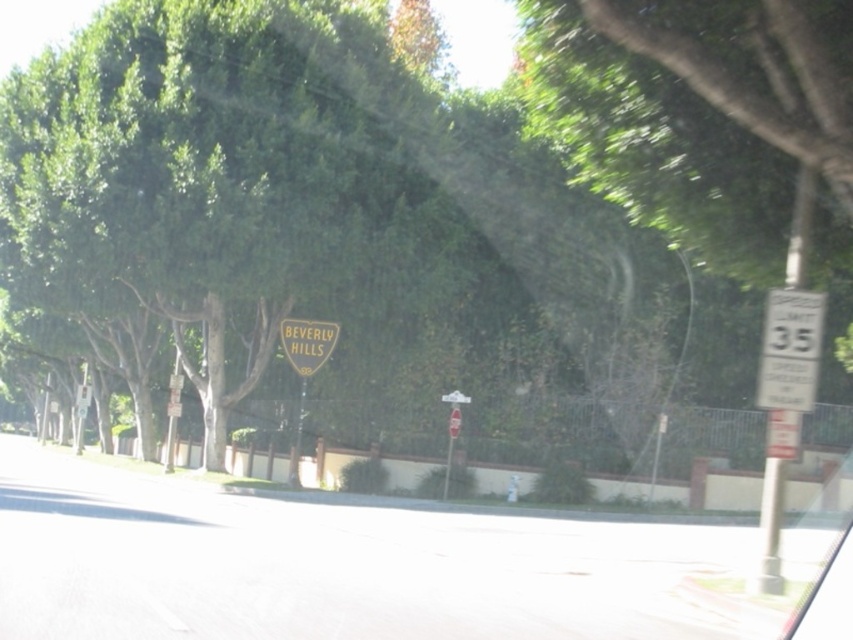
Is white plastic speed limit sign at right positioned at the back of yellowmaterial/texturebeverly hills sign at center?

No, it is not.

I want to click on white plastic speed limit sign at right, so click(x=790, y=349).

Locate an element on the screen. The height and width of the screenshot is (640, 853). white plastic speed limit sign at right is located at coordinates (790, 349).